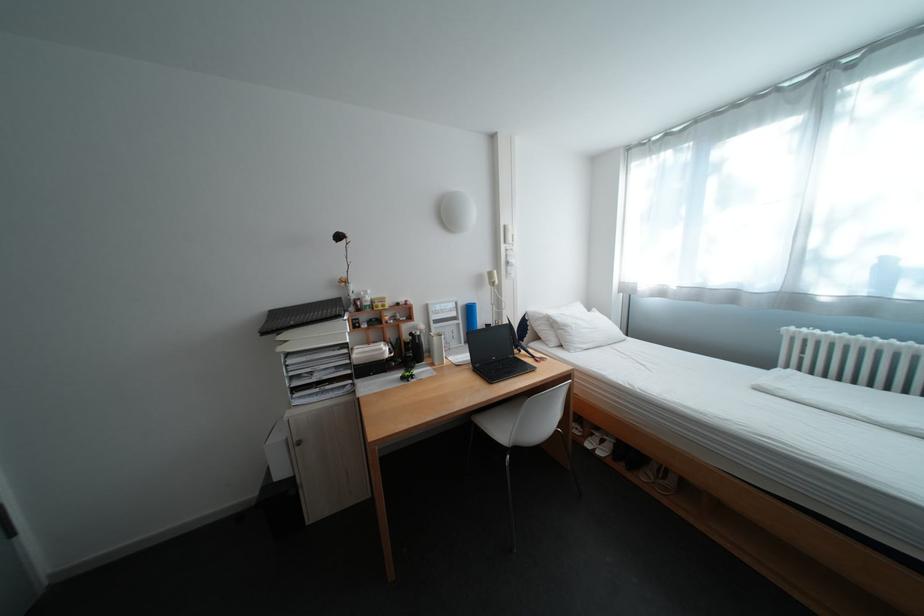
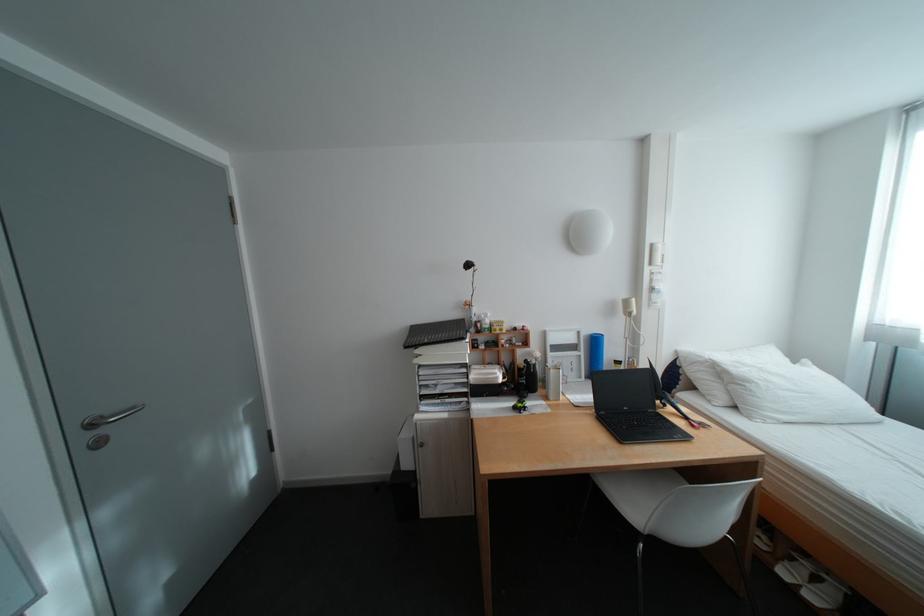
The point at (517, 228) is marked in the first image. Where is the corresponding point in the second image?

(664, 246)